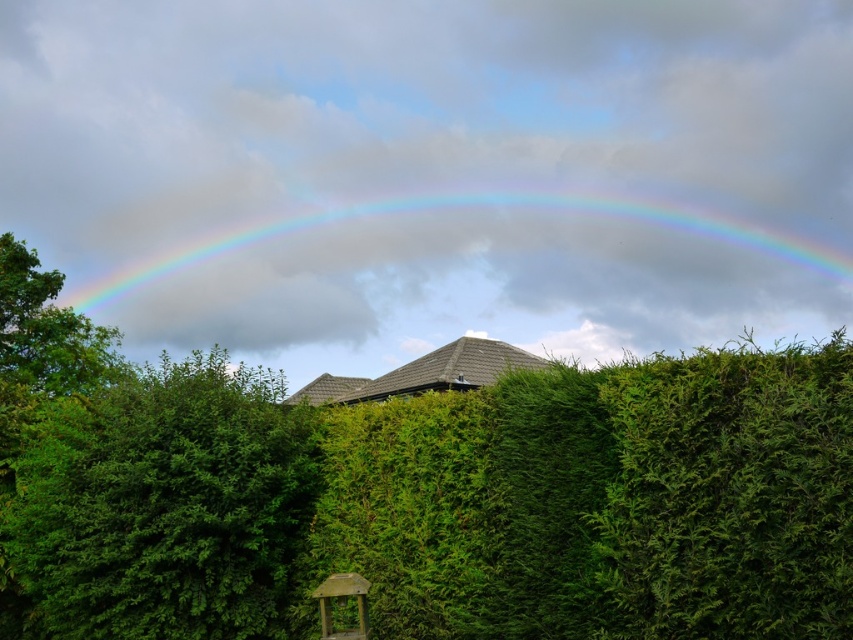
The width and height of the screenshot is (853, 640). Identify the location of green leafy bush at left. (164, 504).

Image resolution: width=853 pixels, height=640 pixels. In order to click on green leafy bush at left in this screenshot , I will do (164, 504).

Is green leafy bush at left in front of glossy rainbow at upper center?

Yes, green leafy bush at left is closer to the viewer.

Describe the element at coordinates (164, 504) in the screenshot. The image size is (853, 640). I see `green leafy bush at left` at that location.

Does point (6, 518) lie in front of point (231, 246)?

That is True.

At what (x,y) coordinates should I click in order to perform the action: click on green leafy bush at left. Please return your answer as a coordinate pair (x, y). Looking at the image, I should click on (164, 504).

Between glossy rainbow at upper center and wooden gazebo at lower center, which one appears on the left side from the viewer's perspective?

Positioned to the left is wooden gazebo at lower center.

Is glossy rainbow at upper center wider than wooden gazebo at lower center?

Correct, the width of glossy rainbow at upper center exceeds that of wooden gazebo at lower center.

Identify the location of glossy rainbow at upper center. (479, 205).